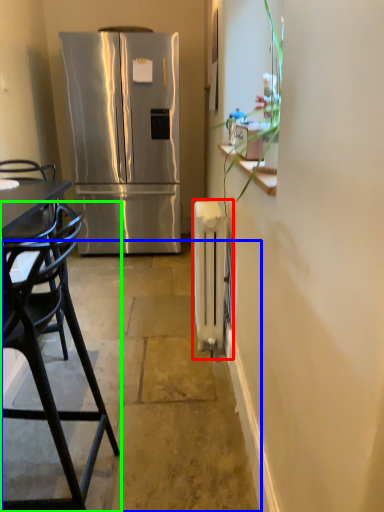
Question: Considering the real-world distances, which object is closest to radiator (highlighted by a red box)? concrete (highlighted by a blue box) or chair (highlighted by a green box).

Choices:
 (A) concrete
 (B) chair

Answer: (A)